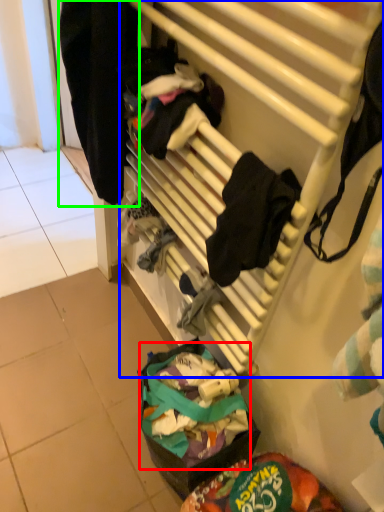
Question: Estimate the real-world distances between objects in this image. Which object is closer to food (highlighted by a red box), furniture (highlighted by a blue box) or clothing (highlighted by a green box)?

Choices:
 (A) furniture
 (B) clothing

Answer: (A)